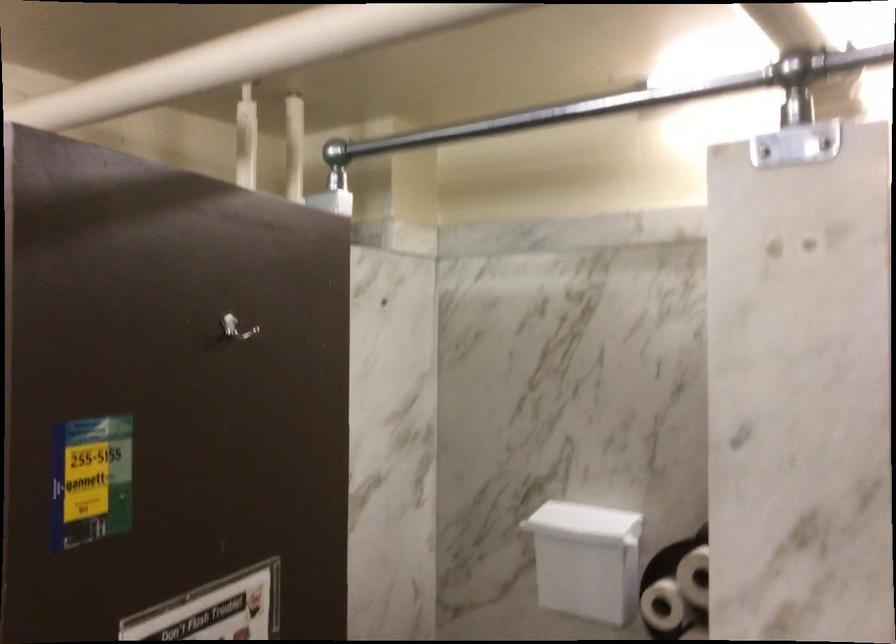
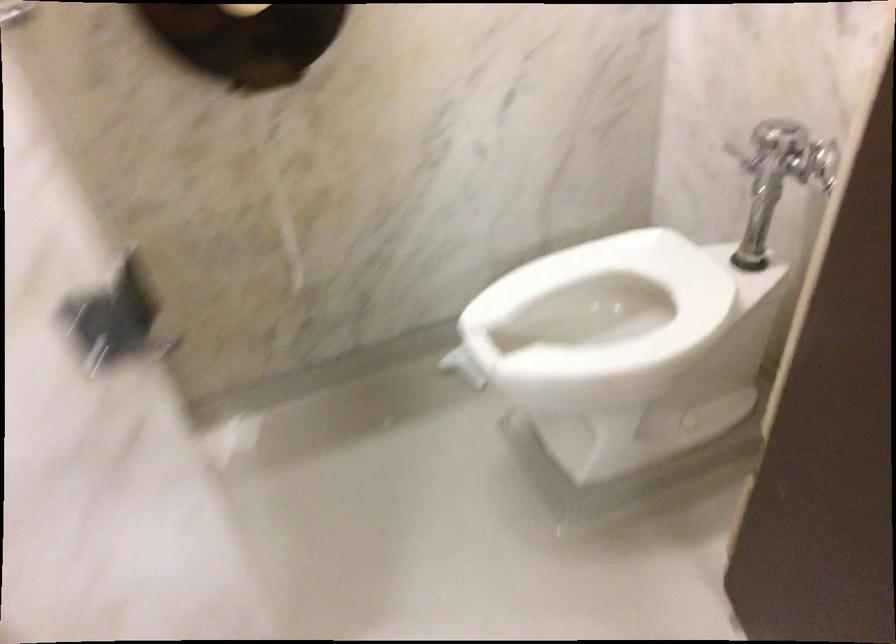
First-person continuous shooting, in which direction is the camera rotating?

The camera's rotation is toward right-down.